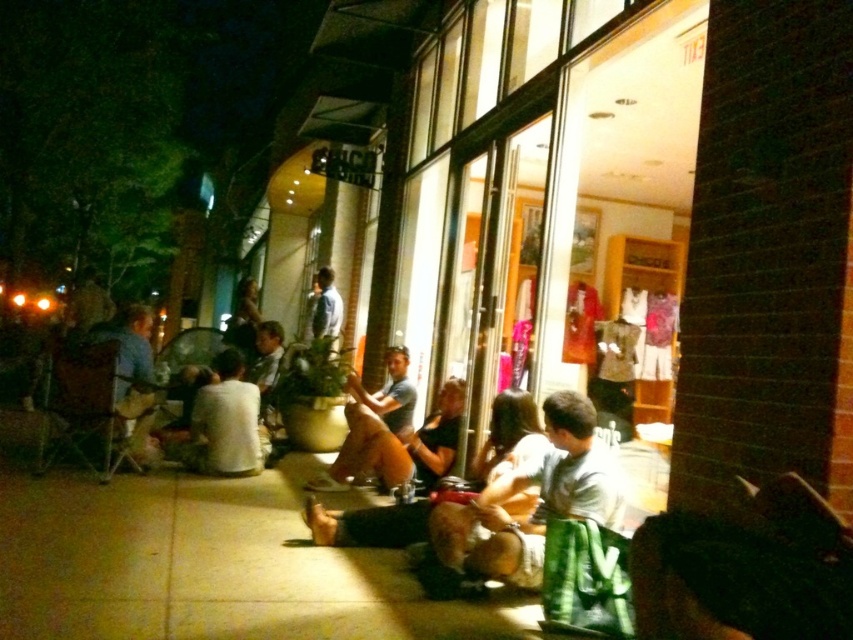
Question: Does smooth concrete pavement at center have a smaller size compared to light blue shirt at center?

Choices:
 (A) no
 (B) yes

Answer: (A)

Question: Which is nearer to the green fabric skirt at center?

Choices:
 (A) light blue shirt at center
 (B) smooth concrete pavement at center

Answer: (B)

Question: Which of the following is the farthest from the observer?

Choices:
 (A) (566, 493)
 (B) (337, 332)

Answer: (B)

Question: From the image, what is the correct spatial relationship of green fabric skirt at center in relation to light blue shirt at center?

Choices:
 (A) right
 (B) left

Answer: (A)

Question: Based on their relative distances, which object is nearer to the green fabric skirt at center?

Choices:
 (A) light blue shirt at center
 (B) smooth concrete pavement at center

Answer: (B)

Question: Does green fabric skirt at center have a smaller size compared to light blue shirt at center?

Choices:
 (A) yes
 (B) no

Answer: (B)